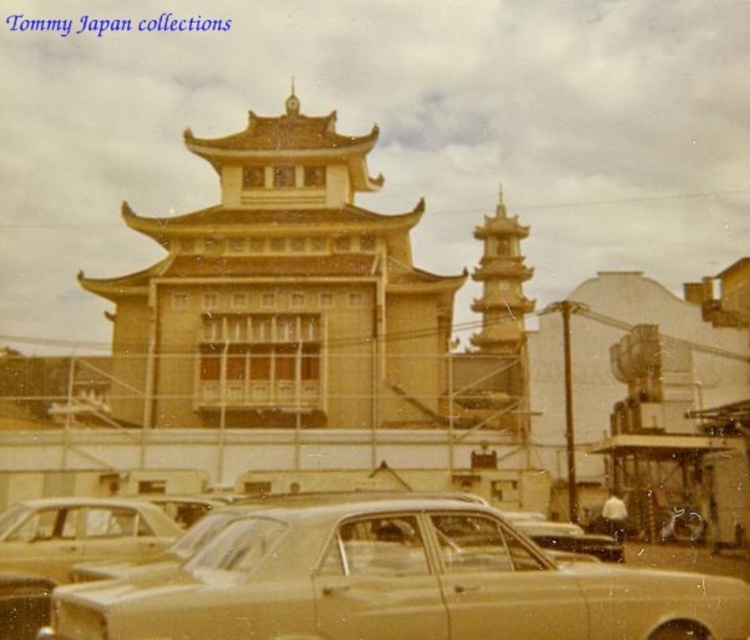
Which is more to the left, gold metallic car at lower center or gold metallic car at lower left?

gold metallic car at lower left is more to the left.

Can you confirm if gold metallic car at lower center is wider than gold metallic car at lower left?

Yes.

Is point (242, 604) more distant than point (116, 525)?

No.

Identify the location of gold metallic car at lower center. The width and height of the screenshot is (750, 640). (396, 582).

This screenshot has width=750, height=640. What do you see at coordinates (280, 292) in the screenshot?
I see `yellow matte temple at center` at bounding box center [280, 292].

Where is `yellow matte temple at center`? yellow matte temple at center is located at coordinates (280, 292).

In order to click on yellow matte temple at center in this screenshot , I will do `click(280, 292)`.

Locate an element on the screen. This screenshot has height=640, width=750. yellow matte temple at center is located at coordinates (280, 292).

Between yellow matte temple at center and gold metallic car at lower center, which one has more height?

yellow matte temple at center

Who is more forward, (138, 420) or (417, 545)?

Point (417, 545)

Is point (422, 323) positioned after point (471, 596)?

That is True.

At what (x,y) coordinates should I click in order to perform the action: click on yellow matte temple at center. Please return your answer as a coordinate pair (x, y). The height and width of the screenshot is (640, 750). Looking at the image, I should click on (280, 292).